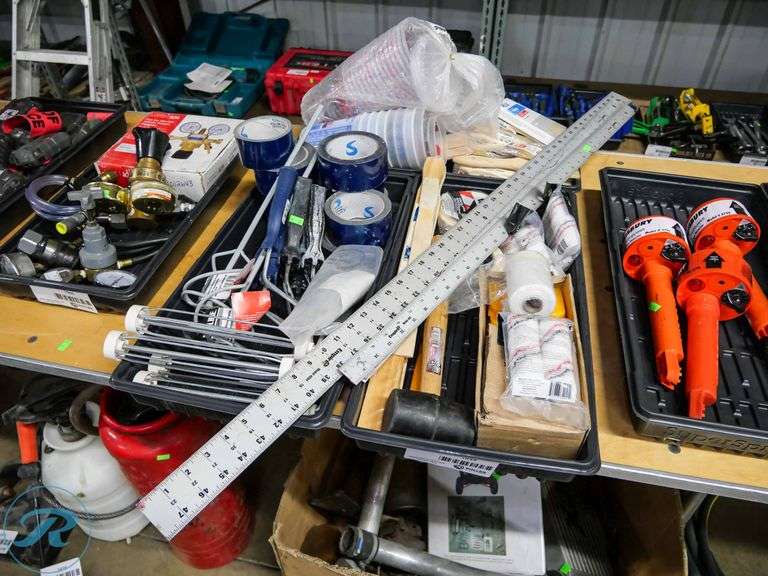
You are a GUI agent. You are given a task and a screenshot of the screen. Output one action in this format:
    pyautogui.click(x=<x>, y=<y>)
    Task: Click on the table
    
    Given the screenshot: What is the action you would take?
    pyautogui.click(x=646, y=462), pyautogui.click(x=40, y=329)